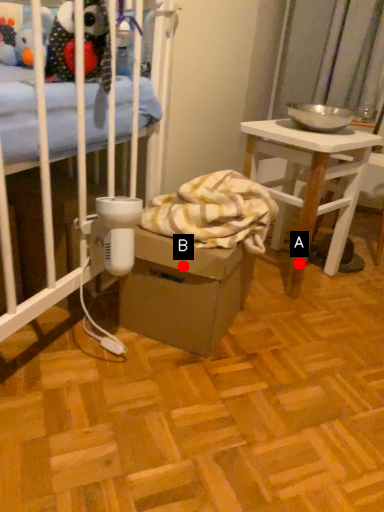
Question: Two points are circled on the image, labeled by A and B beside each circle. Which of the following is the farthest from the observer?

Choices:
 (A) A is further
 (B) B is further

Answer: (A)